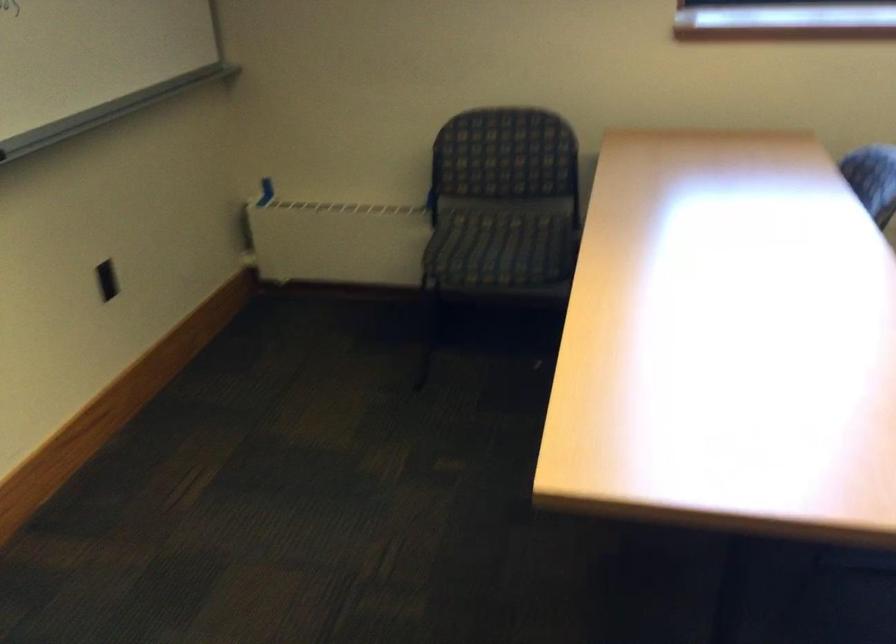
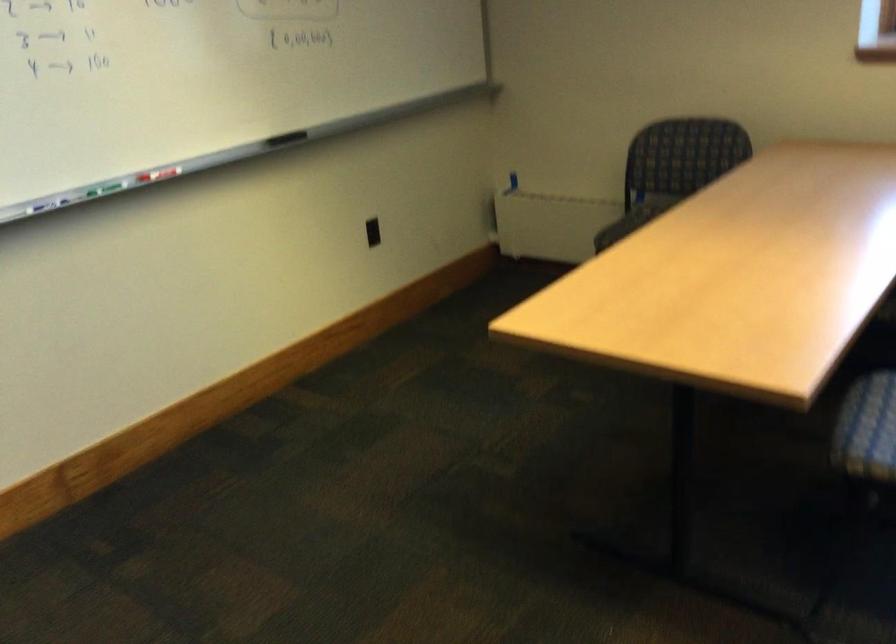
Where in the second image is the point corresponding to (x=283, y=190) from the first image?

(513, 180)